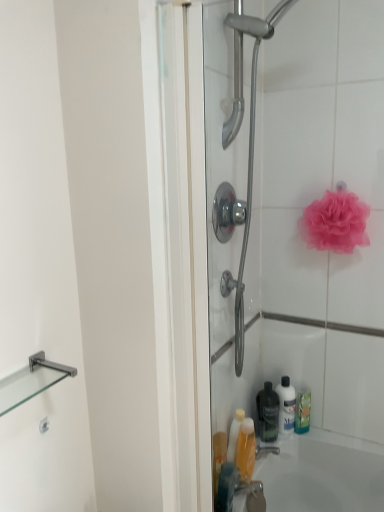
What is the approximate width of black matte bottle at lower center?

7.41 centimeters.

What do you see at coordinates (302, 244) in the screenshot? This screenshot has height=512, width=384. I see `transparent glass shower door at center` at bounding box center [302, 244].

Describe the element at coordinates (246, 448) in the screenshot. The height and width of the screenshot is (512, 384). I see `translucent plastic bottle at lower center` at that location.

You are a GUI agent. You are given a task and a screenshot of the screen. Output one action in this format:
    pyautogui.click(x=<x>, y=<y>)
    Task: Click on the clear glass shelf at left
    
    Given the screenshot: What is the action you would take?
    pyautogui.click(x=31, y=381)

Considering the points (233, 335) and (254, 443), which point is behind, point (233, 335) or point (254, 443)?

Positioned behind is point (254, 443).

Which object is positioned more to the left, transparent glass shower door at center or translucent plastic bottle at lower center?

transparent glass shower door at center is more to the left.

Considering the relative sizes of transparent glass shower door at center and translucent plastic bottle at lower center in the image provided, is transparent glass shower door at center shorter than translucent plastic bottle at lower center?

No, transparent glass shower door at center is not shorter than translucent plastic bottle at lower center.

What's the angular difference between transparent glass shower door at center and translucent plastic bottle at lower center's facing directions?

transparent glass shower door at center and translucent plastic bottle at lower center are facing 88 degrees away from each other.

From a real-world perspective, does yellow translucent bottle at lower center, the 3th cleaning product when ordered from right to left, sit lower than clear glass shelf at left?

Yes.

Is yellow translucent bottle at lower center, the 3th cleaning product when ordered from right to left, positioned far away from clear glass shelf at left?

That's not correct — yellow translucent bottle at lower center, the 3th cleaning product when ordered from right to left, is a little close to clear glass shelf at left.

Is yellow translucent bottle at lower center, acting as the third cleaning product starting from the back, thinner than clear glass shelf at left?

Correct, the width of yellow translucent bottle at lower center, acting as the third cleaning product starting from the back, is less than that of clear glass shelf at left.

In the scene shown: From the image's perspective, is yellow translucent bottle at lower center, acting as the third cleaning product starting from the back, positioned above or below clear glass shelf at left?

yellow translucent bottle at lower center, acting as the third cleaning product starting from the back, is situated lower than clear glass shelf at left in the image.

Is the depth of yellow translucent bottle at lower center, acting as the third cleaning product starting from the back, greater than that of green matte bottle at lower right, the 2th cleaning product when ordered from front to back?

No, it is in front of green matte bottle at lower right, the 2th cleaning product when ordered from front to back.

Is yellow translucent bottle at lower center, which is the 1th cleaning product in front-to-back order, outside of green matte bottle at lower right, which is counted as the second cleaning product, starting from the back?

Indeed, yellow translucent bottle at lower center, which is the 1th cleaning product in front-to-back order, is completely outside green matte bottle at lower right, which is counted as the second cleaning product, starting from the back.

Could you tell me if yellow translucent bottle at lower center, acting as the third cleaning product starting from the back, is facing green matte bottle at lower right, which is counted as the second cleaning product, starting from the back?

No, yellow translucent bottle at lower center, acting as the third cleaning product starting from the back, is not facing towards green matte bottle at lower right, which is counted as the second cleaning product, starting from the back.

Is green matte bottle at lower right, which ranks as the third cleaning product in left-to-right order, looking in the opposite direction of black matte bottle at lower center?

No, green matte bottle at lower right, which ranks as the third cleaning product in left-to-right order,'s orientation is not away from black matte bottle at lower center.

From a real-world perspective, is green matte bottle at lower right, which is counted as the second cleaning product, starting from the back, under black matte bottle at lower center?

Yes, from a real-world perspective, green matte bottle at lower right, which is counted as the second cleaning product, starting from the back, is under black matte bottle at lower center.

Between green matte bottle at lower right, the 2th cleaning product when ordered from front to back, and black matte bottle at lower center, which one has less height?

With less height is green matte bottle at lower right, the 2th cleaning product when ordered from front to back.

In terms of height, does transparent glass shower door at center look taller or shorter compared to black matte bottle at lower center?

Clearly, transparent glass shower door at center is taller compared to black matte bottle at lower center.

Looking at this image, considering the positions of objects transparent glass shower door at center and black matte bottle at lower center in the image provided, who is more to the left, transparent glass shower door at center or black matte bottle at lower center?

From the viewer's perspective, transparent glass shower door at center appears more on the left side.

Is transparent glass shower door at center not near black matte bottle at lower center?

transparent glass shower door at center is actually quite close to black matte bottle at lower center.

From the image's perspective, is transparent glass shower door at center over black matte bottle at lower center?

Yes.

What are the coordinates of `cleaning product that is the 2nd one when counting backward from the pink mesh sponge at upper right` in the screenshot? It's located at (303, 412).

In the image, is green matte bottle at lower right, positioned as the first cleaning product in right-to-left order, on the left side or the right side of pink mesh sponge at upper right?

green matte bottle at lower right, positioned as the first cleaning product in right-to-left order, is positioned on pink mesh sponge at upper right's left side.

In terms of height, does green matte bottle at lower right, which ranks as the third cleaning product in left-to-right order, look taller or shorter compared to pink mesh sponge at upper right?

Considering their sizes, green matte bottle at lower right, which ranks as the third cleaning product in left-to-right order, has less height than pink mesh sponge at upper right.

How distant is clear glass shelf at left from pink mesh sponge at upper right?

A distance of 37.70 inches exists between clear glass shelf at left and pink mesh sponge at upper right.

Consider the image. Is clear glass shelf at left to the left of pink mesh sponge at upper right from the viewer's perspective?

Yes.

Who is taller, clear glass shelf at left or pink mesh sponge at upper right?

pink mesh sponge at upper right.

From the image's perspective, which one is positioned higher, clear glass shelf at left or pink mesh sponge at upper right?

pink mesh sponge at upper right appears higher in the image.

This screenshot has width=384, height=512. Identify the location of shower door above the translucent plastic bottle at lower center (from the image's perspective). (302, 244).

Identify the location of balustrade on the left of yellow translucent bottle at lower center, which is the first cleaning product from left to right. (31, 381).

Considering their positions, is transparent glass shower door at center positioned closer to yellow translucent bottle at lower center, acting as the third cleaning product starting from the back, than green matte bottle at lower right, positioned as the first cleaning product in right-to-left order?

green matte bottle at lower right, positioned as the first cleaning product in right-to-left order, is closer to yellow translucent bottle at lower center, acting as the third cleaning product starting from the back.

Looking at the image, which one is located further to black matte bottle at lower center, yellow translucent bottle at lower center, acting as the third cleaning product starting from the back, or pink mesh sponge at upper right?

pink mesh sponge at upper right lies further to black matte bottle at lower center than the other object.

Based on the photo, considering their positions, is translucent plastic bottle at lower right, acting as the third cleaning product starting from the front, positioned closer to black matte bottle at lower center than translucent plastic bottle at lower center?

Among the two, translucent plastic bottle at lower right, acting as the third cleaning product starting from the front, is located nearer to black matte bottle at lower center.

Looking at the image, which one is located closer to transparent glass shower door at center, translucent plastic bottle at lower right, acting as the third cleaning product starting from the front, or black matte bottle at lower center?

Based on the image, translucent plastic bottle at lower right, acting as the third cleaning product starting from the front, appears to be nearer to transparent glass shower door at center.

Considering their positions, is pink mesh sponge at upper right positioned further to yellow translucent bottle at lower center, the 3th cleaning product when ordered from right to left, than black matte bottle at lower center?

Based on the image, pink mesh sponge at upper right appears to be further to yellow translucent bottle at lower center, the 3th cleaning product when ordered from right to left.

Which object lies further to the anchor point translucent plastic bottle at lower center, black matte bottle at lower center or translucent plastic bottle at lower right, which is the 2th cleaning product from left to right?

The object further to translucent plastic bottle at lower center is translucent plastic bottle at lower right, which is the 2th cleaning product from left to right.

Which object lies nearer to the anchor point black matte bottle at lower center, transparent glass shower door at center or translucent plastic bottle at lower right, acting as the third cleaning product starting from the front?

Based on the image, translucent plastic bottle at lower right, acting as the third cleaning product starting from the front, appears to be nearer to black matte bottle at lower center.

From the image, which object appears to be nearer to yellow translucent bottle at lower center, acting as the third cleaning product starting from the back, pink mesh sponge at upper right or translucent plastic bottle at lower right, positioned as the first cleaning product in back-to-front order?

The object closer to yellow translucent bottle at lower center, acting as the third cleaning product starting from the back, is translucent plastic bottle at lower right, positioned as the first cleaning product in back-to-front order.

Locate an element on the screen. cleaning product between pink mesh sponge at upper right and black matte bottle at lower center in the vertical direction is located at coordinates (286, 405).

Where is `toiletry between clear glass shelf at left and yellow translucent bottle at lower center, the 3th cleaning product when ordered from right to left, in the front-back direction`? The image size is (384, 512). toiletry between clear glass shelf at left and yellow translucent bottle at lower center, the 3th cleaning product when ordered from right to left, in the front-back direction is located at coordinates (246, 448).

Find the location of `shower door between clear glass shelf at left and pink mesh sponge at upper right`. shower door between clear glass shelf at left and pink mesh sponge at upper right is located at coordinates (302, 244).

Identify the location of bottle situated between yellow translucent bottle at lower center, which is the 1th cleaning product in front-to-back order, and translucent plastic bottle at lower right, acting as the third cleaning product starting from the front, from left to right. (267, 413).